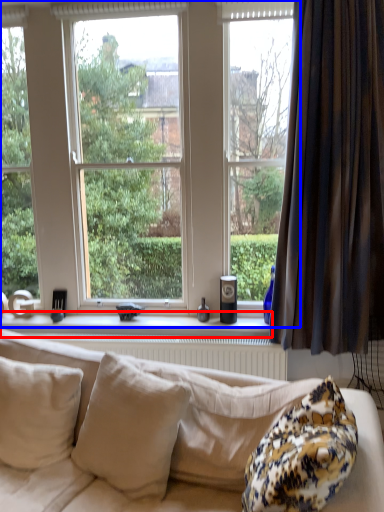
Question: Which object is further to the camera taking this photo, window sill (highlighted by a red box) or window (highlighted by a blue box)?

Choices:
 (A) window sill
 (B) window

Answer: (A)